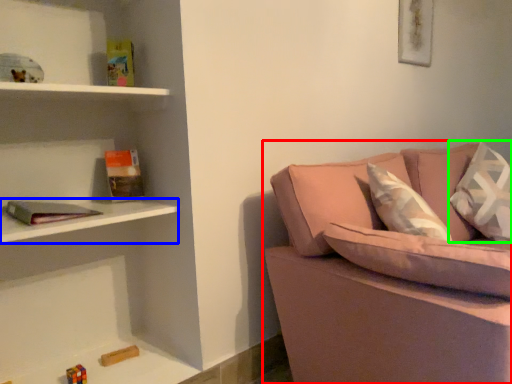
Question: Which object is positioned closest to studio couch (highlighted by a red box)? Select from cabinet (highlighted by a blue box) and pillow (highlighted by a green box).

Choices:
 (A) cabinet
 (B) pillow

Answer: (A)